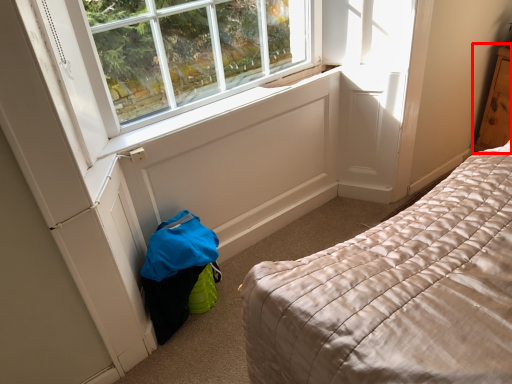
Question: From the image, what is the correct spatial relationship of dresser (annotated by the red box) in relation to window sill?

Choices:
 (A) left
 (B) right

Answer: (B)